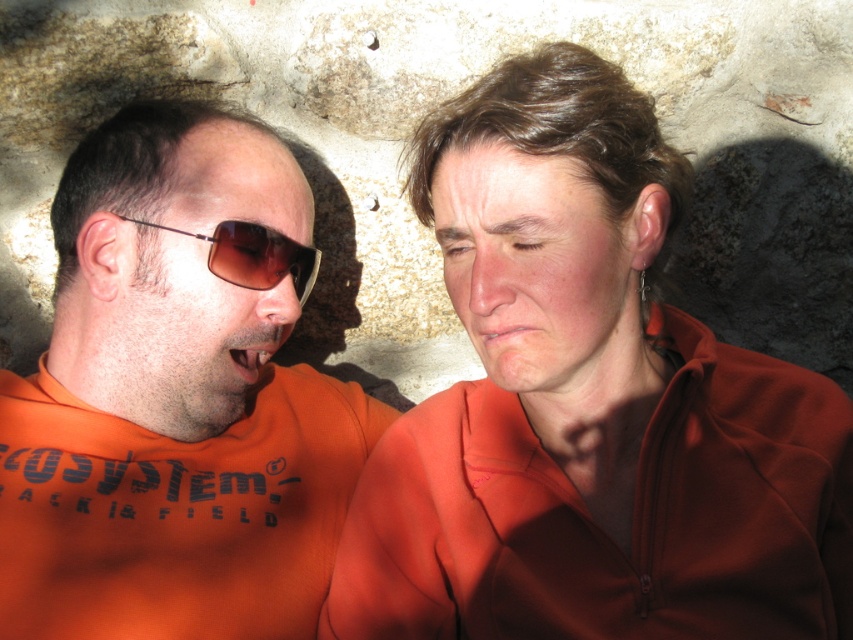
You are a photographer trying to capture a candid shot of the two people in the scene. You notice the matte orange jacket at center and the matte orange sunglasses at left. Which object is positioned lower in the frame?

The matte orange jacket at center is located below the matte orange sunglasses at left, so the matte orange jacket at center is positioned lower in the frame.